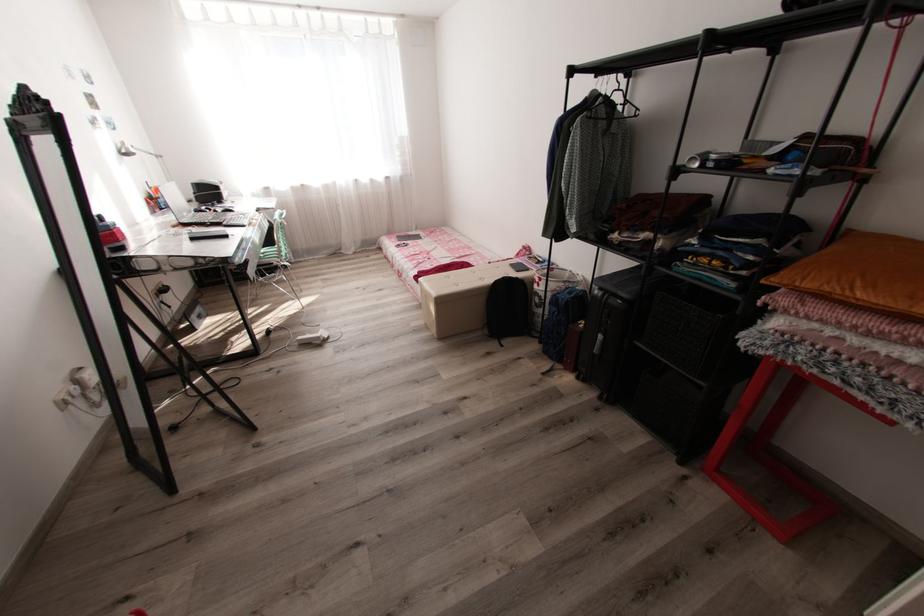
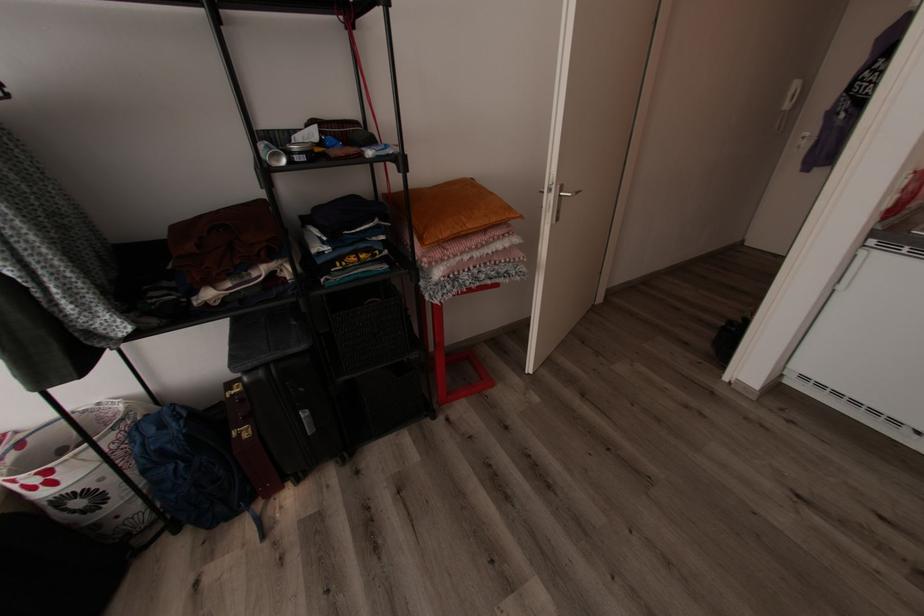
The first image is from the beginning of the video and the second image is from the end. How did the camera likely rotate when shooting the video?

The rotation direction of the camera is right-down.